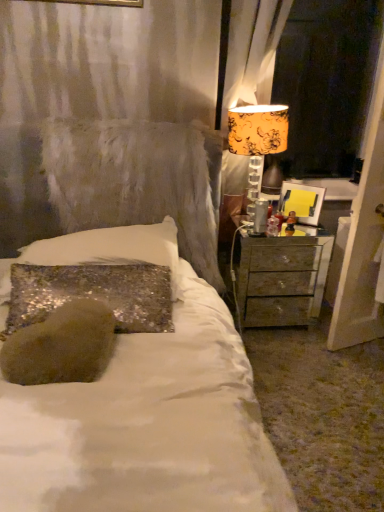
Question: Does orange floral fabric lampshade at upper right contain orange floral fabric at right?

Choices:
 (A) no
 (B) yes

Answer: (A)

Question: Does orange floral fabric lampshade at upper right lie in front of orange floral fabric at right?

Choices:
 (A) yes
 (B) no

Answer: (A)

Question: From the image's perspective, is orange floral fabric lampshade at upper right under orange floral fabric at right?

Choices:
 (A) yes
 (B) no

Answer: (A)

Question: Is orange floral fabric lampshade at upper right bigger than orange floral fabric at right?

Choices:
 (A) yes
 (B) no

Answer: (B)

Question: Does orange floral fabric lampshade at upper right lie behind orange floral fabric at right?

Choices:
 (A) yes
 (B) no

Answer: (B)

Question: From a real-world perspective, is orange floral fabric lampshade at upper right physically below orange floral fabric at right?

Choices:
 (A) no
 (B) yes

Answer: (B)

Question: Can you confirm if yellow paper at right is wider than metallic silver nightstand at right?

Choices:
 (A) no
 (B) yes

Answer: (A)

Question: Does yellow paper at right have a lesser width compared to metallic silver nightstand at right?

Choices:
 (A) yes
 (B) no

Answer: (A)

Question: Can you confirm if yellow paper at right is positioned to the right of metallic silver nightstand at right?

Choices:
 (A) yes
 (B) no

Answer: (A)

Question: Can metallic silver nightstand at right be found inside yellow paper at right?

Choices:
 (A) yes
 (B) no

Answer: (B)

Question: Is yellow paper at right positioned beyond the bounds of metallic silver nightstand at right?

Choices:
 (A) no
 (B) yes

Answer: (B)

Question: Is the position of yellow paper at right more distant than that of metallic silver nightstand at right?

Choices:
 (A) yes
 (B) no

Answer: (A)

Question: Is orange floral fabric lampshade at upper right beside metallic silver nightstand at right?

Choices:
 (A) yes
 (B) no

Answer: (B)